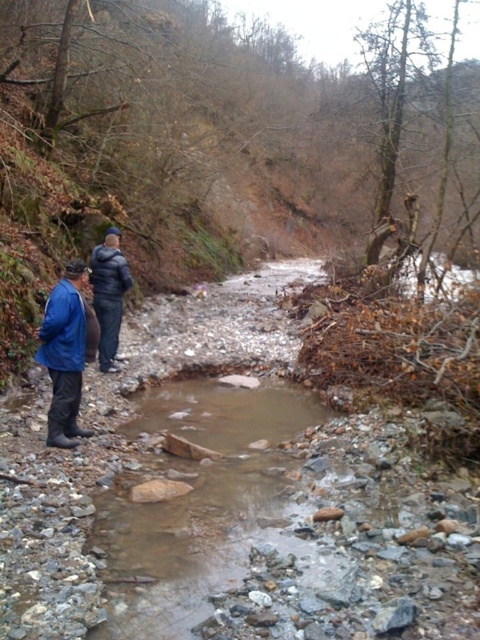
Which is in front, point (59, 380) or point (111, 312)?

Point (59, 380) is more forward.

Looking at this image, who is more distant from viewer, (70, 376) or (122, 292)?

Point (122, 292)

Which is in front, point (75, 429) or point (116, 333)?

Positioned in front is point (75, 429).

This screenshot has width=480, height=640. I want to click on blue fabric jacket at lower left, so tap(64, 355).